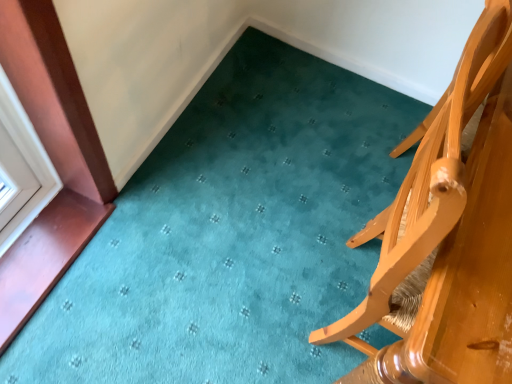
The height and width of the screenshot is (384, 512). What are the coordinates of `light brown wooden chair at right` in the screenshot? It's located at coord(447,235).

What is the approximate height of light brown wooden chair at right?

97.74 centimeters.

Image resolution: width=512 pixels, height=384 pixels. Describe the element at coordinates (447, 235) in the screenshot. I see `light brown wooden chair at right` at that location.

This screenshot has width=512, height=384. I want to click on light brown wooden chair at right, so click(x=447, y=235).